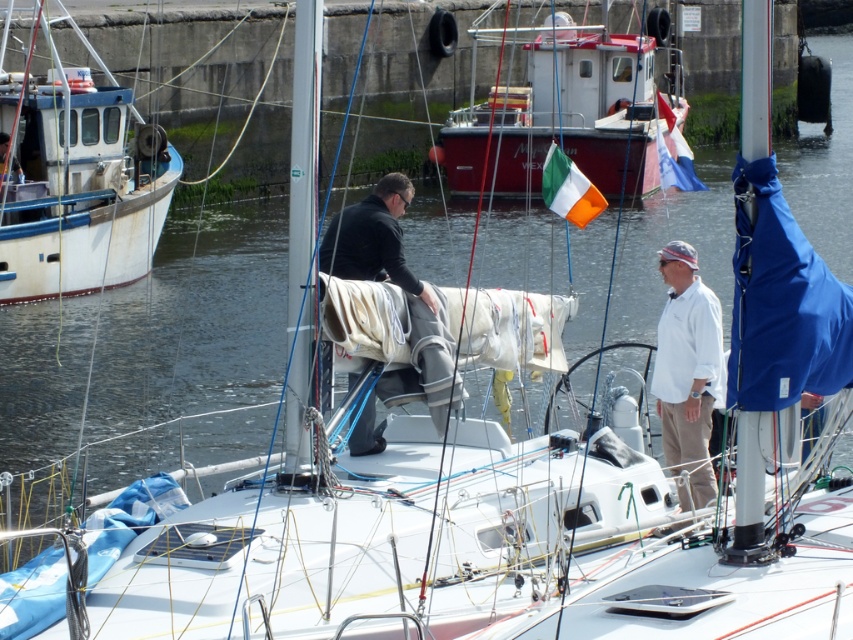
This screenshot has width=853, height=640. What do you see at coordinates (76, 184) in the screenshot?
I see `white matte boat at left` at bounding box center [76, 184].

Is the position of white matte boat at left less distant than that of red metallic boat at upper center?

Yes, white matte boat at left is closer to the viewer.

Between point (120, 164) and point (566, 113), which one is positioned in front?

Positioned in front is point (120, 164).

Where is `white matte boat at left`? This screenshot has height=640, width=853. white matte boat at left is located at coordinates (76, 184).

The image size is (853, 640). Identify the location of white matte boat at left. (76, 184).

What do you see at coordinates (76, 184) in the screenshot? I see `white matte boat at left` at bounding box center [76, 184].

You are a GUI agent. You are given a task and a screenshot of the screen. Output one action in this format:
    pyautogui.click(x=<x>, y=<y>)
    Task: Click on the white matte boat at left
    
    Given the screenshot: What is the action you would take?
    pyautogui.click(x=76, y=184)

You are a GUI agent. You are given a task and a screenshot of the screen. Output one action in this format:
    pyautogui.click(x=<x>, y=<y>)
    Task: Click on the red metallic boat at upper center
    
    Given the screenshot: What is the action you would take?
    pyautogui.click(x=572, y=115)

Between red metallic boat at upper center and dark gray fabric sail at center, which one is positioned higher?

red metallic boat at upper center

Find the location of a particular element. Image resolution: width=853 pixels, height=640 pixels. red metallic boat at upper center is located at coordinates (572, 115).